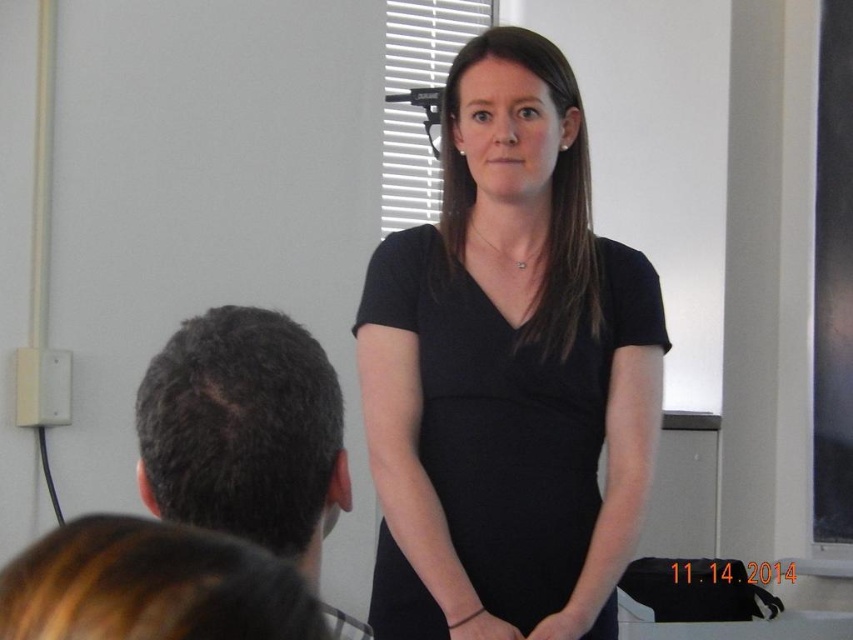
Question: Observing the image, what is the correct spatial positioning of black matte dress at center in reference to dark brown hair at left?

Choices:
 (A) above
 (B) below

Answer: (A)

Question: Is black matte dress at center in front of dark brown hair at left?

Choices:
 (A) no
 (B) yes

Answer: (A)

Question: Can you confirm if black matte dress at center is positioned to the right of dark brown hair at left?

Choices:
 (A) yes
 (B) no

Answer: (A)